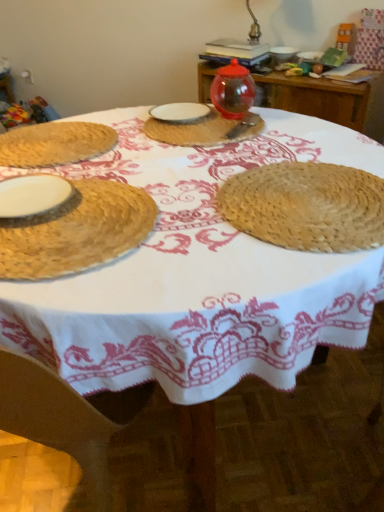
Where is `empty space that is ontop of white matte plate at left, which is the 4th tableware in back-to-front order (from a real-world perspective)`? empty space that is ontop of white matte plate at left, which is the 4th tableware in back-to-front order (from a real-world perspective) is located at coordinates (32, 193).